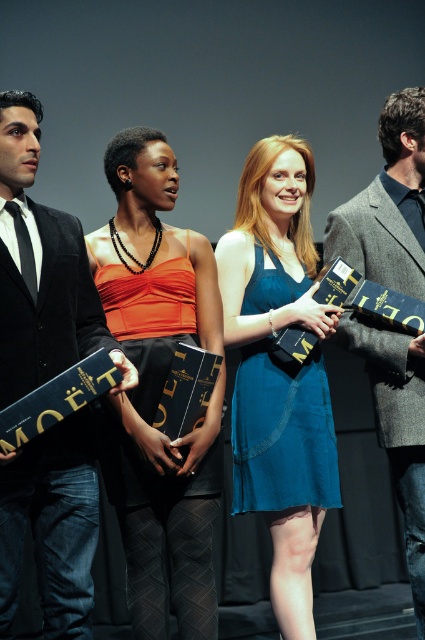
Does black suit at left appear on the right side of teal denim dress at center?

Incorrect, black suit at left is not on the right side of teal denim dress at center.

Between black suit at left and teal denim dress at center, which one is positioned higher?

black suit at left is higher up.

The image size is (425, 640). What are the coordinates of `black suit at left` in the screenshot? It's located at (42, 269).

Is teal denim dress at center to the right of gray wool suit at right from the viewer's perspective?

In fact, teal denim dress at center is to the left of gray wool suit at right.

Is teal denim dress at center positioned behind gray wool suit at right?

No, teal denim dress at center is closer to the viewer.

What do you see at coordinates (278, 371) in the screenshot? The image size is (425, 640). I see `teal denim dress at center` at bounding box center [278, 371].

Where is `teal denim dress at center`? The width and height of the screenshot is (425, 640). teal denim dress at center is located at coordinates (278, 371).

Can you confirm if teal denim dress at center is positioned to the right of teal silk dress at center?

Correct, you'll find teal denim dress at center to the right of teal silk dress at center.

Can you confirm if teal denim dress at center is wider than teal silk dress at center?

Indeed, teal denim dress at center has a greater width compared to teal silk dress at center.

Consider the image. Who is more forward, (286, 593) or (274, 392)?

Point (286, 593) is more forward.

You are a GUI agent. You are given a task and a screenshot of the screen. Output one action in this format:
    pyautogui.click(x=<x>, y=<y>)
    Task: Click on the teal denim dress at center
    
    Given the screenshot: What is the action you would take?
    pyautogui.click(x=278, y=371)